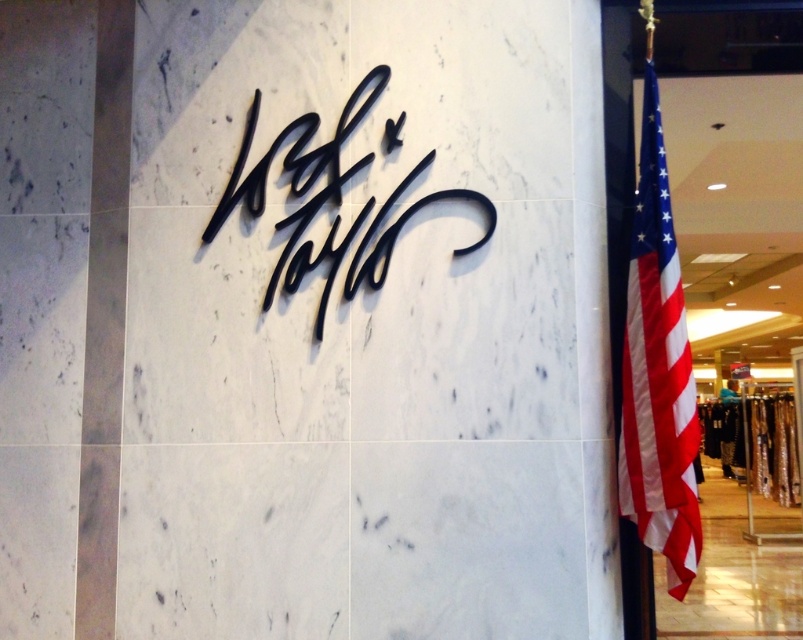
Question: Is american flag at right smaller than black metal sign at center?

Choices:
 (A) no
 (B) yes

Answer: (A)

Question: Does american flag at right appear on the right side of black metal sign at center?

Choices:
 (A) no
 (B) yes

Answer: (B)

Question: Which of the following is the closest to the observer?

Choices:
 (A) american flag at right
 (B) black metal sign at center

Answer: (A)

Question: Does american flag at right lie in front of black metal sign at center?

Choices:
 (A) yes
 (B) no

Answer: (A)